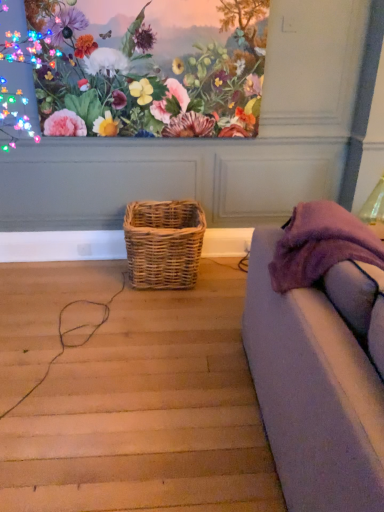
I want to click on free area in between purple fabric couch at right and woven natural basket at center, so click(204, 351).